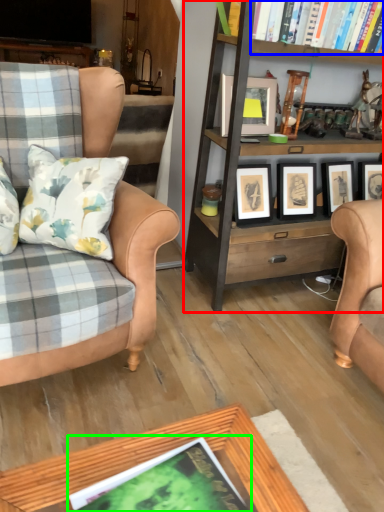
Question: Which object is the farthest from bookcase (highlighted by a red box)? Choose among these: book (highlighted by a blue box) or book (highlighted by a green box).

Choices:
 (A) book
 (B) book

Answer: (B)